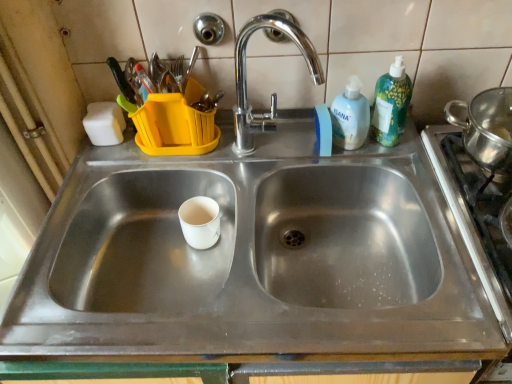
Question: Considering the positions of white matte paper cup at center and white matte sponge at upper left in the image, is white matte paper cup at center taller or shorter than white matte sponge at upper left?

Choices:
 (A) short
 (B) tall

Answer: (A)

Question: Relative to white matte sponge at upper left, is white matte paper cup at center in front or behind?

Choices:
 (A) behind
 (B) front

Answer: (B)

Question: Considering the real-world distances, which object is farthest from the green plastic bottle at upper right, positioned as the second cleaning product in left-to-right order?

Choices:
 (A) white matte sponge at upper left
 (B) polished chrome faucet at upper center
 (C) stainless steel gas stove at right
 (D) white matte paper cup at center
 (E) white plastic bottle at upper right, the 1th cleaning product when ordered from left to right

Answer: (A)

Question: Considering the real-world distances, which object is closest to the white matte sponge at upper left?

Choices:
 (A) polished chrome faucet at upper center
 (B) stainless steel gas stove at right
 (C) white plastic bottle at upper right, marked as the 2th cleaning product in a right-to-left arrangement
 (D) green plastic bottle at upper right, arranged as the 1th cleaning product when viewed from the right
 (E) white matte paper cup at center

Answer: (E)